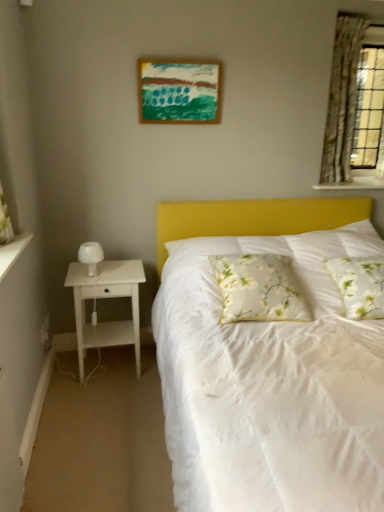
Question: Does white floral pillow at center, marked as the second pillow in a right-to-left arrangement, come in front of white matte table lamp at left?

Choices:
 (A) yes
 (B) no

Answer: (A)

Question: Are white floral pillow at center, marked as the second pillow in a right-to-left arrangement, and white matte table lamp at left making contact?

Choices:
 (A) no
 (B) yes

Answer: (A)

Question: Can you confirm if white floral pillow at center, which is the 1th pillow from left to right, is bigger than white matte table lamp at left?

Choices:
 (A) yes
 (B) no

Answer: (A)

Question: Considering the relative sizes of white floral pillow at center, which is the 1th pillow from left to right, and white matte table lamp at left in the image provided, is white floral pillow at center, which is the 1th pillow from left to right, smaller than white matte table lamp at left?

Choices:
 (A) yes
 (B) no

Answer: (B)

Question: From a real-world perspective, does white floral pillow at center, marked as the second pillow in a right-to-left arrangement, sit lower than white matte table lamp at left?

Choices:
 (A) no
 (B) yes

Answer: (B)

Question: Is green floral fabric curtain at upper right bigger or smaller than white textured shelf at upper right?

Choices:
 (A) big
 (B) small

Answer: (A)

Question: From the image's perspective, relative to white textured shelf at upper right, is green floral fabric curtain at upper right above or below?

Choices:
 (A) below
 (B) above

Answer: (B)

Question: Is green floral fabric curtain at upper right in front of or behind white textured shelf at upper right in the image?

Choices:
 (A) behind
 (B) front

Answer: (B)

Question: Considering the positions of green floral fabric curtain at upper right and white textured shelf at upper right in the image, is green floral fabric curtain at upper right taller or shorter than white textured shelf at upper right?

Choices:
 (A) short
 (B) tall

Answer: (B)

Question: Relative to white floral pillow at center, marked as the second pillow in a right-to-left arrangement, is white matte table lamp at left in front or behind?

Choices:
 (A) front
 (B) behind

Answer: (B)

Question: From a real-world perspective, is white matte table lamp at left positioned above or below white floral pillow at center, which is the 1th pillow from left to right?

Choices:
 (A) below
 (B) above

Answer: (B)

Question: Considering the relative positions of white matte table lamp at left and white floral pillow at center, marked as the second pillow in a right-to-left arrangement, in the image provided, is white matte table lamp at left to the left or to the right of white floral pillow at center, marked as the second pillow in a right-to-left arrangement,?

Choices:
 (A) left
 (B) right

Answer: (A)

Question: From their relative heights in the image, would you say white matte table lamp at left is taller or shorter than white floral pillow at center, which is the 1th pillow from left to right?

Choices:
 (A) tall
 (B) short

Answer: (B)

Question: Considering their positions, is white floral fabric pillow at center, the 2th pillow when ordered from left to right, located in front of or behind white textured shelf at upper right?

Choices:
 (A) front
 (B) behind

Answer: (A)

Question: From the image's perspective, is white floral fabric pillow at center, the 2th pillow when ordered from left to right, positioned above or below white textured shelf at upper right?

Choices:
 (A) above
 (B) below

Answer: (B)